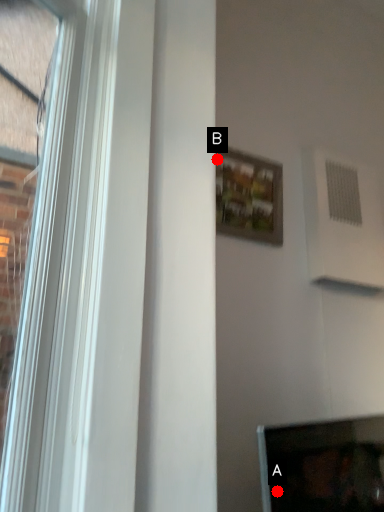
Question: Two points are circled on the image, labeled by A and B beside each circle. Which point is farther to the camera?

Choices:
 (A) A is further
 (B) B is further

Answer: (A)